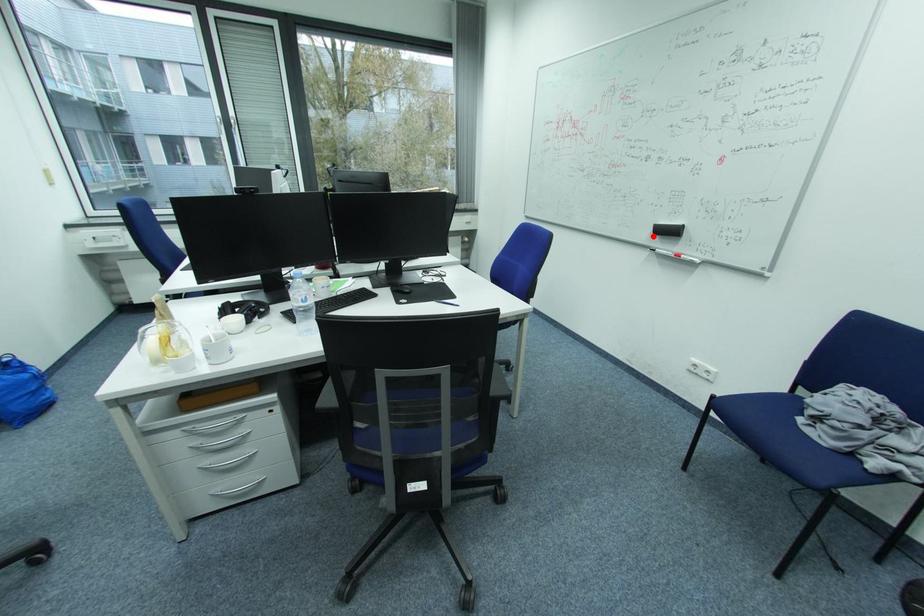
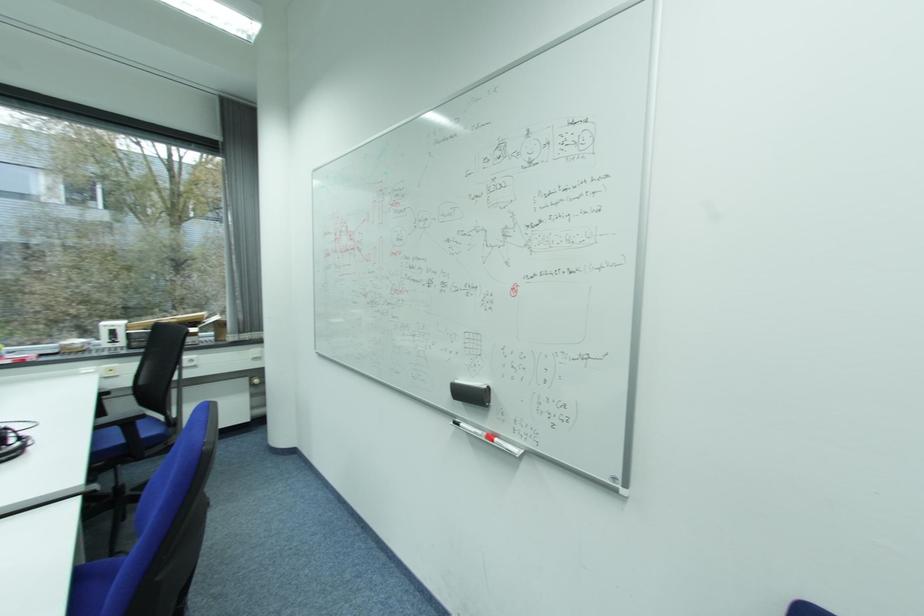
Question: I am providing you with two images of the same scene from different viewpoints. A red point is shown in image1. For the corresponding object point in image2, is it positioned nearer or farther from the camera?

Choices:
 (A) Nearer
 (B) Farther

Answer: (B)